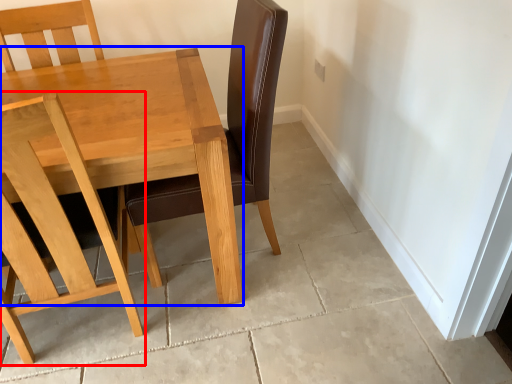
Question: Which object is closer to the camera taking this photo, chair (highlighted by a red box) or table (highlighted by a blue box)?

Choices:
 (A) chair
 (B) table

Answer: (A)